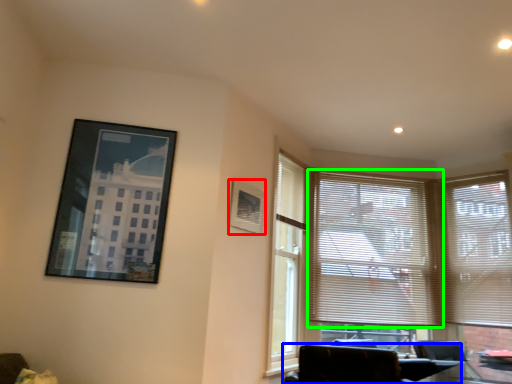
Question: Estimate the real-world distances between objects in this image. Which object is farther from picture frame (highlighted by a red box), chair (highlighted by a blue box) or window blind (highlighted by a green box)?

Choices:
 (A) chair
 (B) window blind

Answer: (B)